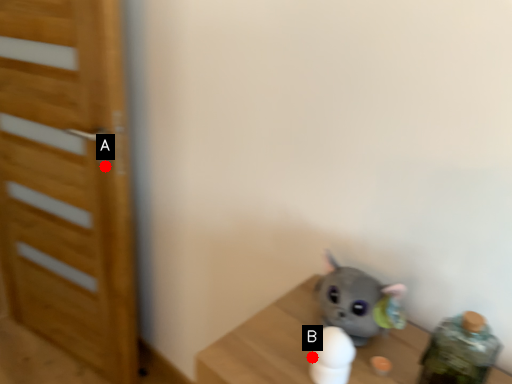
Question: Two points are circled on the image, labeled by A and B beside each circle. Which point is farther from the camera taking this photo?

Choices:
 (A) A is further
 (B) B is further

Answer: (A)